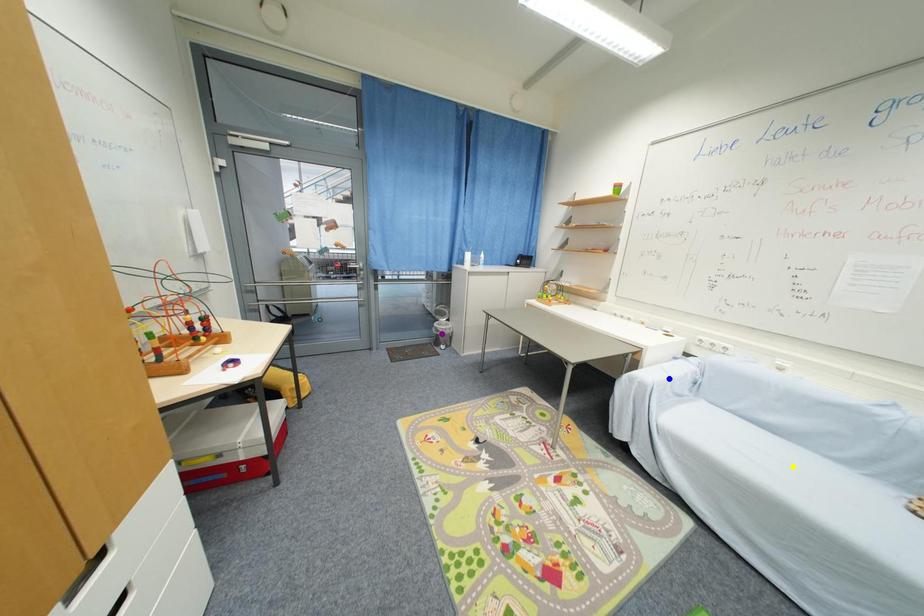
Order these from nearest to farthest:
yellow point | blue point | purple point

yellow point
blue point
purple point